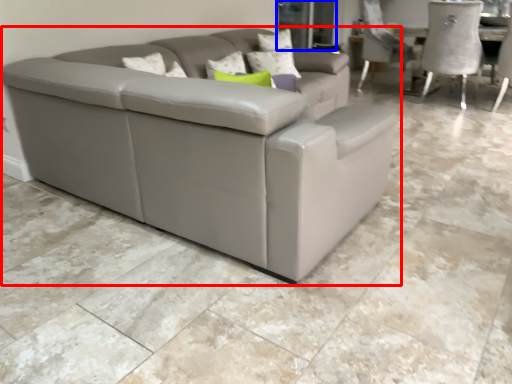
Question: Among these objects, which one is farthest to the camera, studio couch (highlighted by a red box) or glass door (highlighted by a blue box)?

Choices:
 (A) studio couch
 (B) glass door

Answer: (B)